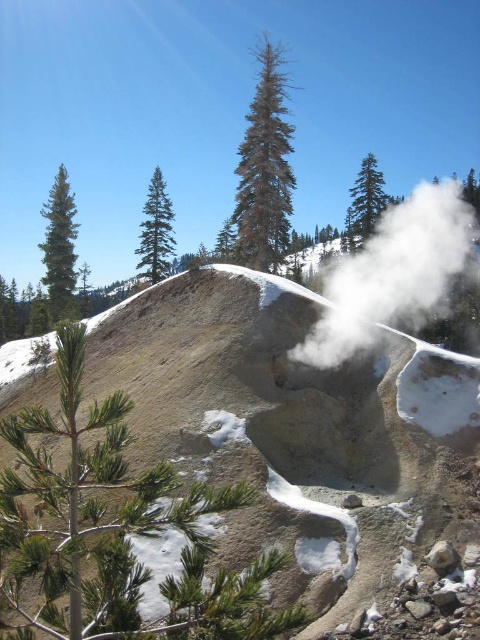
From the picture: You are a photographer standing at the edge of the rock formation in the foreground. You want to take a photo that includes both point A at point (x=266, y=195) and point B at point (x=146, y=266). Which point will appear larger in your photo?

Point A at point (x=266, y=195) will appear larger in the photo because it is closer to the camera than point B at point (x=146, y=266).